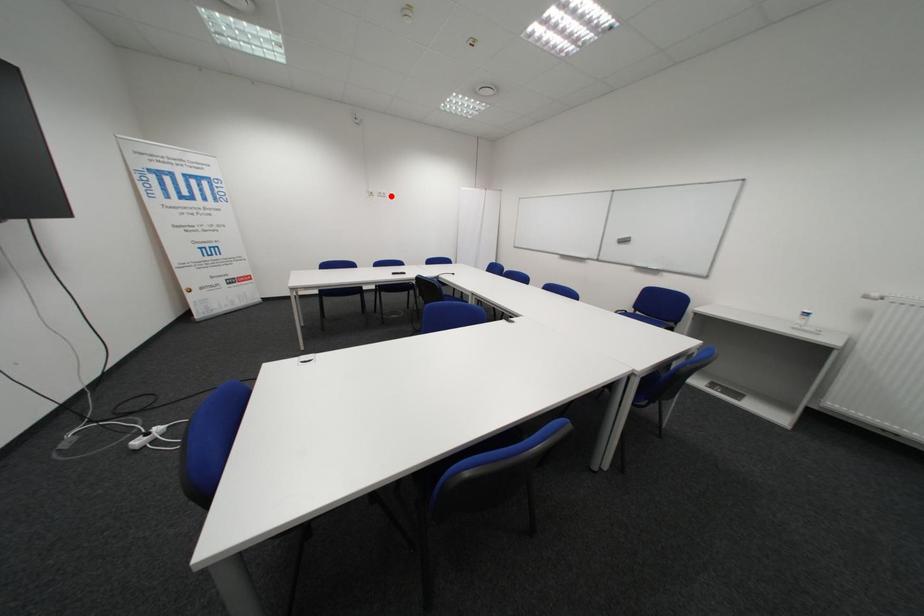
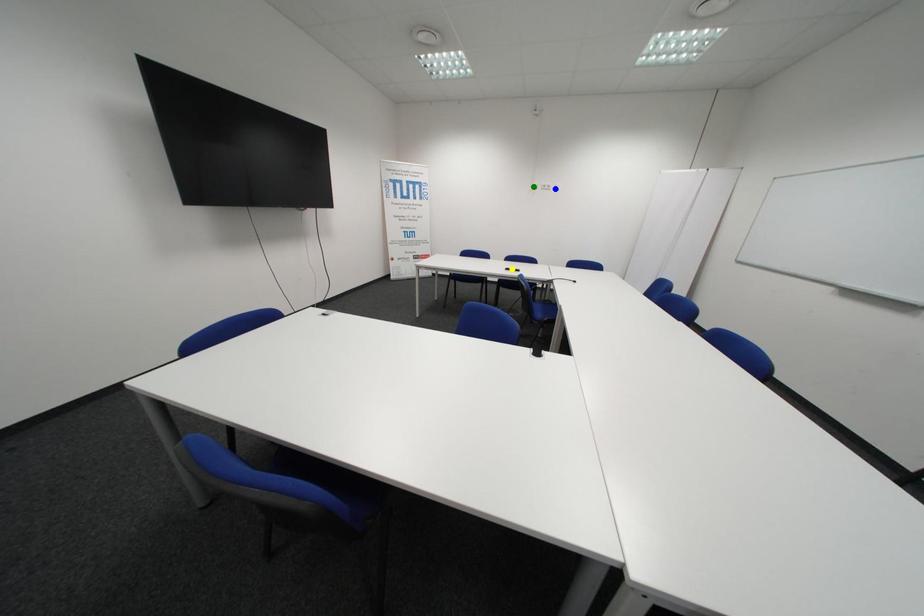
Question: I am providing you with two images of the same scene from different viewpoints. A red point is marked on the first image. You are given multiple points on the second image. In image 2, which mark is for the same physical point as the one in image 1?

Choices:
 (A) green point
 (B) blue point
 (C) yellow point

Answer: (B)